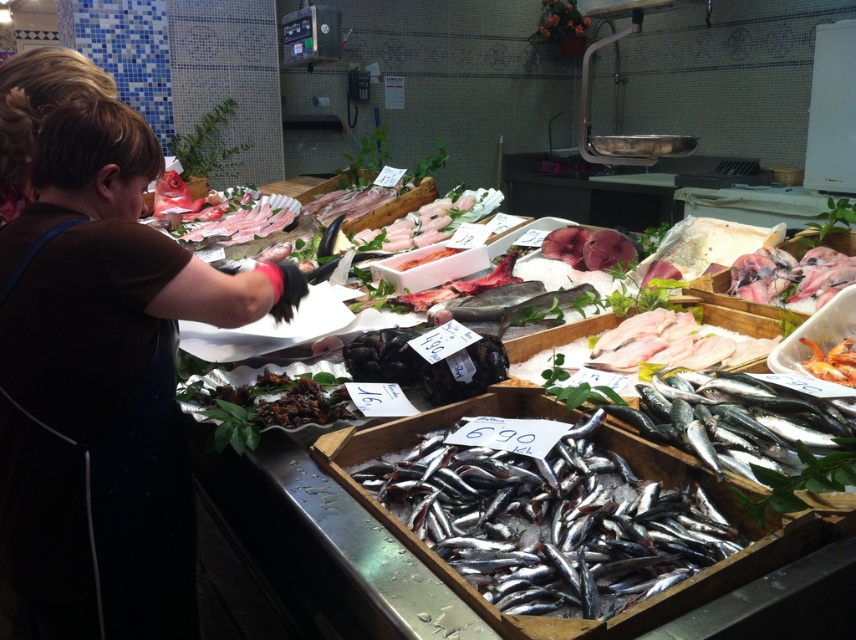
You are a customer at the fish market and want to buy both the brown fabric at left and the shiny silver fish at lower right. However, your bag can only hold one item at a time. Which item should you pick first if you want to carry the larger item first?

The brown fabric at left is bigger than the shiny silver fish at lower right, so you should pick the brown fabric at left first.

You are a customer at the fish market and want to compare the height of the brown fabric at left and the shiny silver fish at lower right. Which one is taller?

The brown fabric at left has a greater height compared to the shiny silver fish at lower right, so the brown fabric at left is taller.